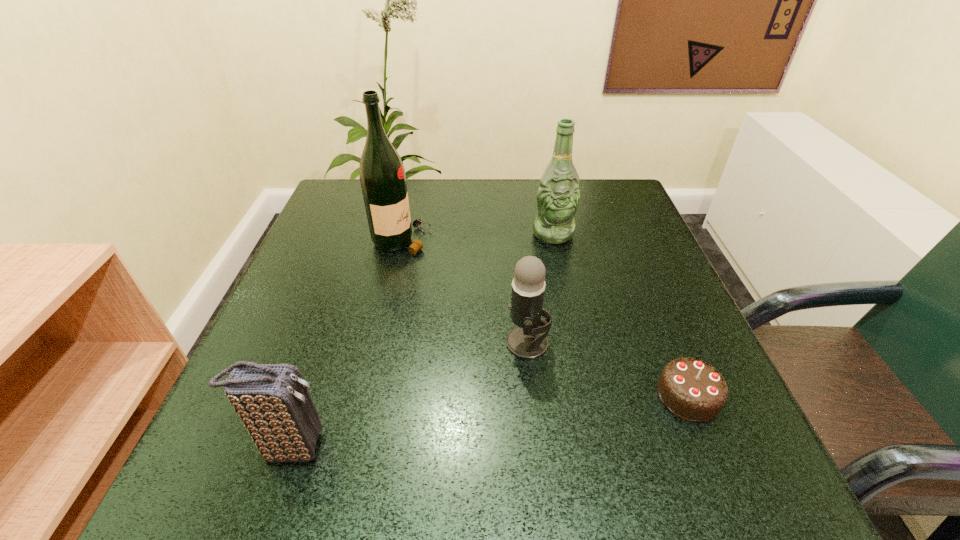
Identify the location of object that is at the near left corner. The image size is (960, 540). (273, 402).

What are the coordinates of `free region at the far edge of the desktop` in the screenshot? It's located at (430, 207).

In the image, there is a desktop. At what (x,y) coordinates should I click in order to perform the action: click on free space at the near edge. Please return your answer as a coordinate pair (x, y). Image resolution: width=960 pixels, height=540 pixels. Looking at the image, I should click on (615, 451).

I want to click on vacant region at the left edge of the desktop, so click(x=284, y=353).

Locate an element on the screen. This screenshot has height=540, width=960. free space at the right edge of the desktop is located at coordinates (608, 297).

In the image, there is a desktop. Identify the location of free region at the far left corner. click(x=315, y=222).

Locate an element on the screen. The image size is (960, 540). free point at the near left corner is located at coordinates (287, 469).

I want to click on free spot at the far right corner of the desktop, so coord(583,224).

Identify the location of free space between the second tallest object and the clutch bag. tap(421, 340).

The height and width of the screenshot is (540, 960). In order to click on vacant region between the third object from right to left and the clutch bag in this screenshot , I will do `click(409, 395)`.